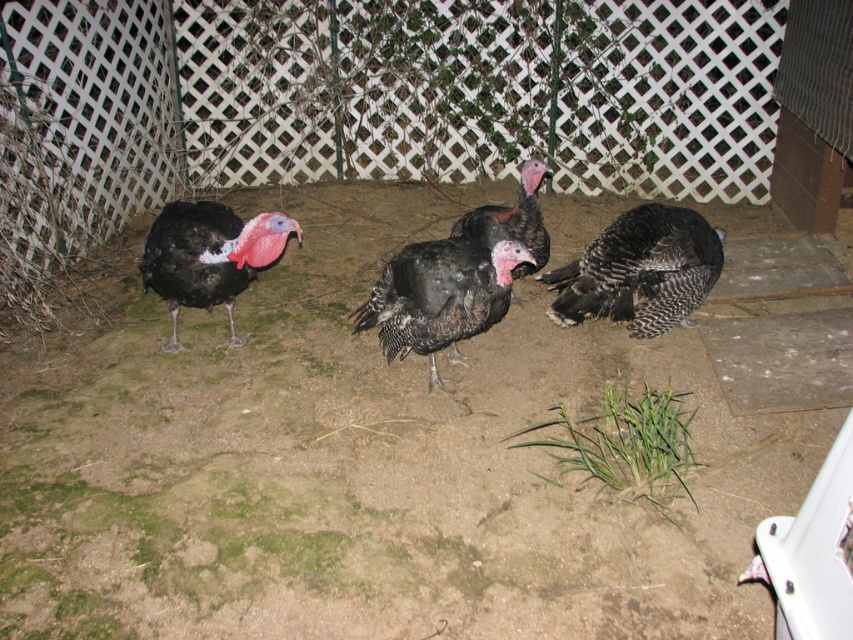
Question: Is black feathered turkey at center thinner than black glossy turkey at center?

Choices:
 (A) no
 (B) yes

Answer: (A)

Question: Is matte black turkey at left thinner than black glossy turkey at center?

Choices:
 (A) no
 (B) yes

Answer: (A)

Question: Which object is farther from the camera taking this photo?

Choices:
 (A) black textured feathers at center
 (B) black feathered turkey at center

Answer: (A)

Question: Estimate the real-world distances between objects in this image. Which object is closer to the matte black turkey at left?

Choices:
 (A) black textured feathers at center
 (B) black glossy turkey at center
 (C) white lattice fence at upper center
 (D) black feathered turkey at center

Answer: (D)

Question: Can you confirm if matte black turkey at left is thinner than black glossy turkey at center?

Choices:
 (A) no
 (B) yes

Answer: (A)

Question: Estimate the real-world distances between objects in this image. Which object is closer to the matte black turkey at left?

Choices:
 (A) white lattice fence at upper center
 (B) black glossy turkey at center
 (C) black feathered turkey at center
 (D) black textured feathers at center

Answer: (C)